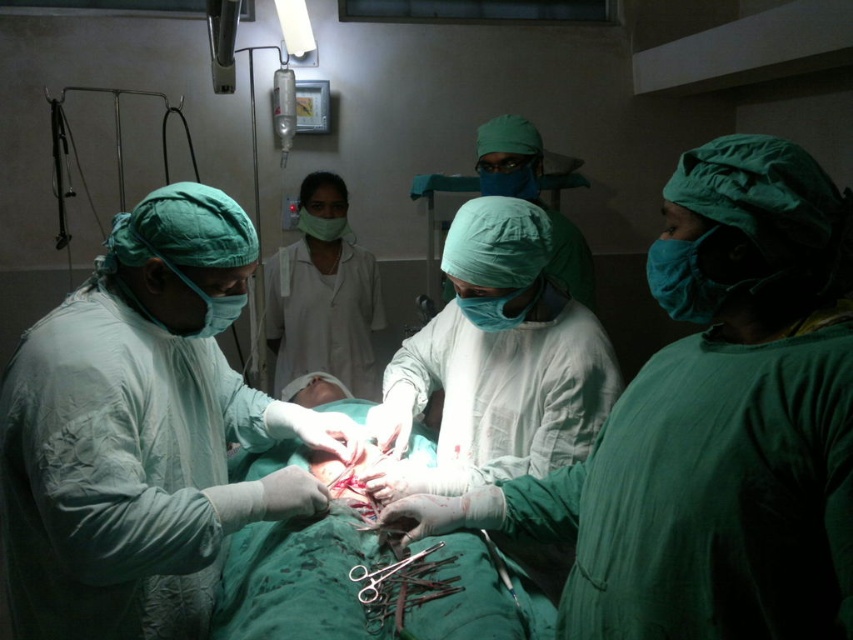
Between white smooth uniform at center and matte green surgical cap at center, which one is positioned lower?

white smooth uniform at center is lower down.

Does white smooth uniform at center have a smaller size compared to matte green surgical cap at center?

Actually, white smooth uniform at center might be larger than matte green surgical cap at center.

This screenshot has width=853, height=640. Describe the element at coordinates (323, 294) in the screenshot. I see `white smooth uniform at center` at that location.

Where is `white smooth uniform at center`? white smooth uniform at center is located at coordinates (323, 294).

Which is above, green matte surgical gown at center or surgical scissors at center?

green matte surgical gown at center

Find the location of `green matte surgical gown at center`. green matte surgical gown at center is located at coordinates (143, 433).

Who is more forward, (126, 384) or (416, 560)?

Positioned in front is point (126, 384).

This screenshot has height=640, width=853. I want to click on green matte surgical gown at center, so click(x=143, y=433).

Between matte green gown at center and green matte surgical gown at center, which one is positioned higher?

green matte surgical gown at center is higher up.

Can you confirm if matte green gown at center is positioned to the left of green matte surgical gown at center?

No, matte green gown at center is not to the left of green matte surgical gown at center.

Who is more distant from viewer, [822,461] or [19,468]?

The point [19,468] is behind.

What are the coordinates of `matte green gown at center` in the screenshot? It's located at (712, 426).